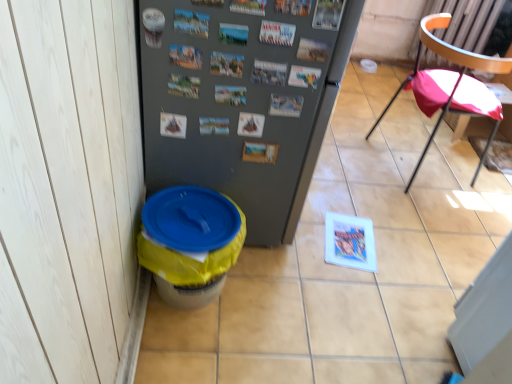
Locate an element on the screen. This screenshot has width=512, height=384. vacant space positioned to the left of pink fabric chair at right is located at coordinates (351, 162).